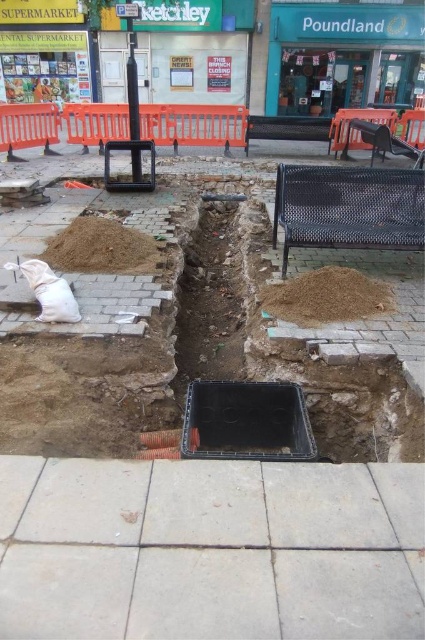
Who is positioned more to the right, gray concrete pavement at center or brown dirt at left?

Positioned to the right is gray concrete pavement at center.

Is gray concrete pavement at center positioned behind brown dirt at left?

No, gray concrete pavement at center is closer to the viewer.

Is point (348, 611) in front of point (113, 237)?

Yes, point (348, 611) is closer to viewer.

In order to click on gray concrete pavement at center in this screenshot , I will do `click(209, 548)`.

Can you confirm if gray concrete pavement at center is positioned to the left of brown sand at lower right?

Indeed, gray concrete pavement at center is positioned on the left side of brown sand at lower right.

Is gray concrete pavement at center bigger than brown sand at lower right?

Yes.

Who is more distant from viewer, [359,636] or [311,321]?

Point [311,321]

Identify the location of gray concrete pavement at center. This screenshot has width=425, height=640. (209, 548).

Can you confirm if brown sand at lower right is smaller than brown dirt at left?

Correct, brown sand at lower right occupies less space than brown dirt at left.

Who is shorter, brown sand at lower right or brown dirt at left?

brown sand at lower right is shorter.

This screenshot has width=425, height=640. Identify the location of brown sand at lower right. (x=325, y=296).